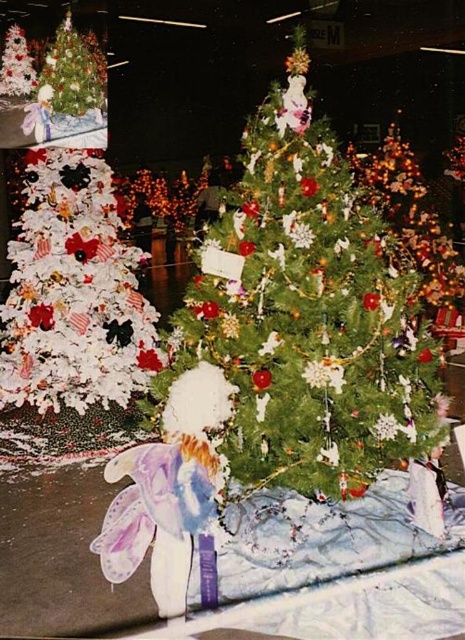
You are setting up a Christmas display and need to place a 3D star on top of the tallest object between the white matte christmas tree at left and the shiny gold ornaments at center. Which object should you place the star on?

The white matte christmas tree at left is wider than the shiny gold ornaments at center, so the star should be placed on the white matte christmas tree at left since it has a larger width and likely a taller structure to support the star.

You are a photographer setting up a shot of the green matte christmas tree at center and the white matte christmas tree at left. Which tree should you focus on first if you want to capture both in a single frame without moving the camera?

The white matte christmas tree at left is higher than the green matte christmas tree at center, so focusing on it first would ensure it stays in frame while adjusting for the lower positioned green tree.